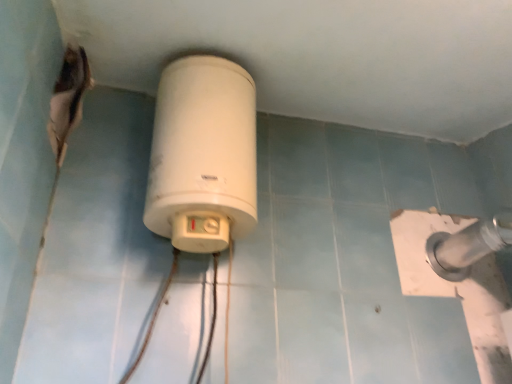
Question: Should I look upward or downward to see white plastic power plugs and sockets at center?

Choices:
 (A) up
 (B) down

Answer: (A)